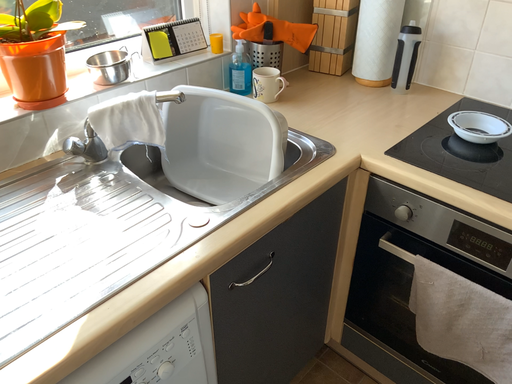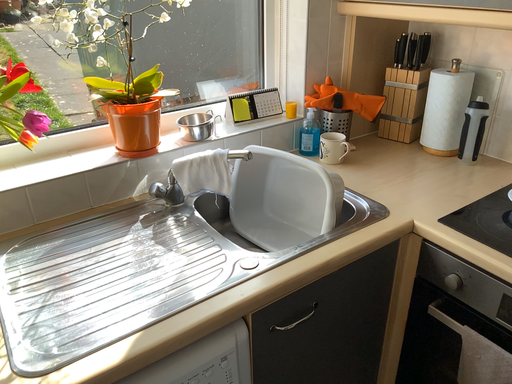
Question: Which way did the camera rotate in the video?

Choices:
 (A) rotated left
 (B) rotated right

Answer: (A)